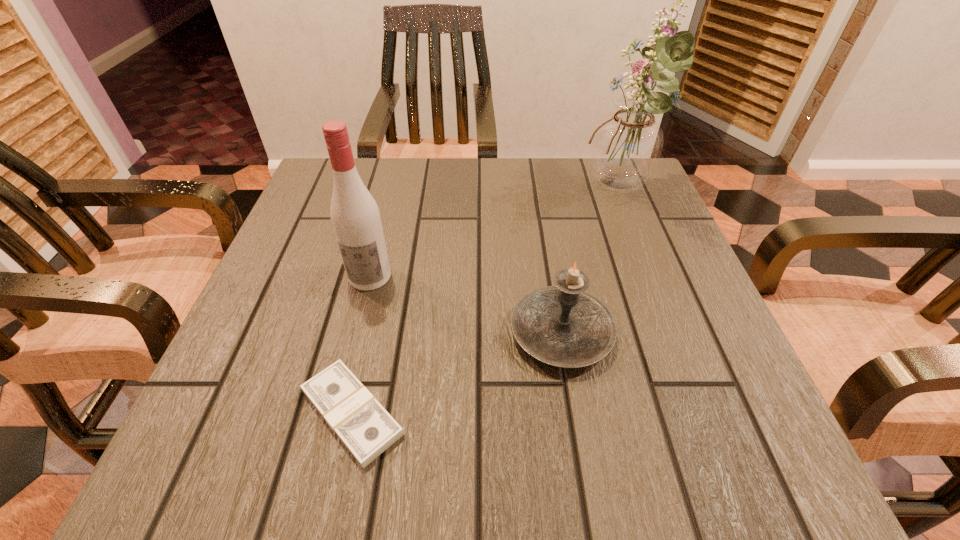
This screenshot has height=540, width=960. In order to click on vacant region at the far edge of the desktop in this screenshot , I will do `click(461, 161)`.

Find the location of a particular element. vacant space at the near edge of the desktop is located at coordinates (470, 460).

In the image, there is a desktop. At what (x,y) coordinates should I click in order to perform the action: click on free region at the left edge. Please return your answer as a coordinate pair (x, y). This screenshot has width=960, height=540. Looking at the image, I should click on (301, 381).

The height and width of the screenshot is (540, 960). Find the location of `vacant space at the right edge of the desktop`. vacant space at the right edge of the desktop is located at coordinates (678, 282).

Locate an element on the screen. The height and width of the screenshot is (540, 960). vacant space at the far left corner of the desktop is located at coordinates (304, 206).

Find the location of a particular element. vacant space at the near left corner is located at coordinates (209, 464).

The width and height of the screenshot is (960, 540). In the image, there is a desktop. In order to click on vacant space at the far right corner in this screenshot , I will do `click(630, 198)`.

In order to click on free spot between the rightmost object and the dollar in this screenshot , I will do coord(486,302).

At what (x,y) coordinates should I click in order to perform the action: click on free point between the second tallest object and the dollar. Please return your answer as a coordinate pair (x, y). The width and height of the screenshot is (960, 540). Looking at the image, I should click on (361, 345).

Find the location of a particular element. The image size is (960, 540). empty space that is in between the dollar and the bouquet is located at coordinates (486, 302).